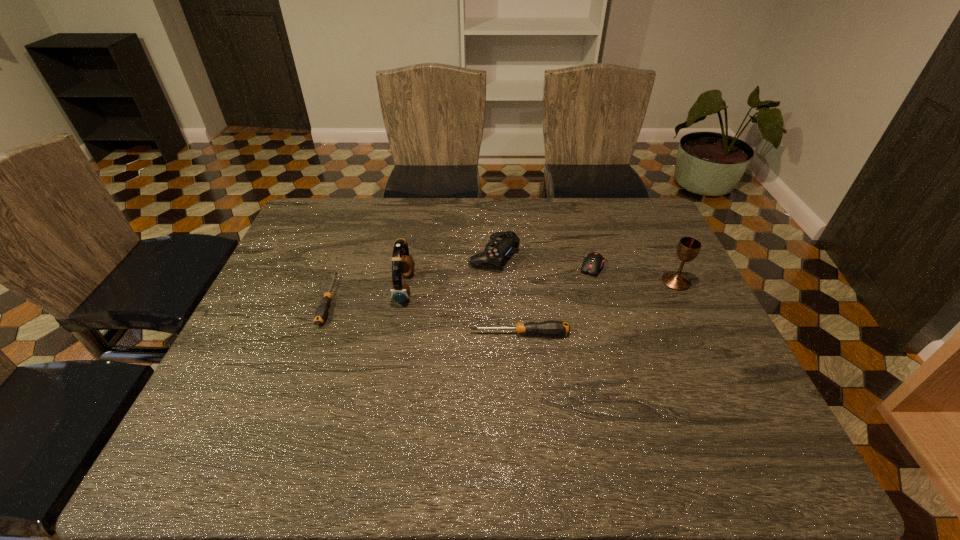
You are a GUI agent. You are given a task and a screenshot of the screen. Output one action in this format:
    pyautogui.click(x=<x>, y=<y>)
    Task: Click on the shorter screwdriver
    Image resolution: width=960 pixels, height=540 pixels.
    Given the screenshot: What is the action you would take?
    pyautogui.click(x=321, y=313)

I want to click on the left screwdriver, so click(x=321, y=313).

Image resolution: width=960 pixels, height=540 pixels. Find the location of `the taller screwdriver`. the taller screwdriver is located at coordinates (551, 327).

The height and width of the screenshot is (540, 960). I want to click on chalice, so click(x=688, y=248).

Find the location of a particular element. the third tallest object is located at coordinates (501, 243).

I want to click on the second object from left to right, so click(x=403, y=265).

Find the location of `computer mouse`. computer mouse is located at coordinates (593, 262).

At what (x,y) coordinates should I click in order to perform the action: click on free space located on the left of the leftmost object. Please return your answer as a coordinate pair (x, y). This screenshot has height=540, width=960. Looking at the image, I should click on (294, 301).

Where is `free region located 0.360m on the left of the right screwdriver`? This screenshot has height=540, width=960. free region located 0.360m on the left of the right screwdriver is located at coordinates (327, 334).

You are a GUI agent. You are given a task and a screenshot of the screen. Output one action in this format:
    pyautogui.click(x=<x>, y=<y>)
    Task: Click on the vacant space situated 0.080m on the back of the rightmost object
    The image size is (960, 540).
    Given the screenshot: What is the action you would take?
    pyautogui.click(x=663, y=255)